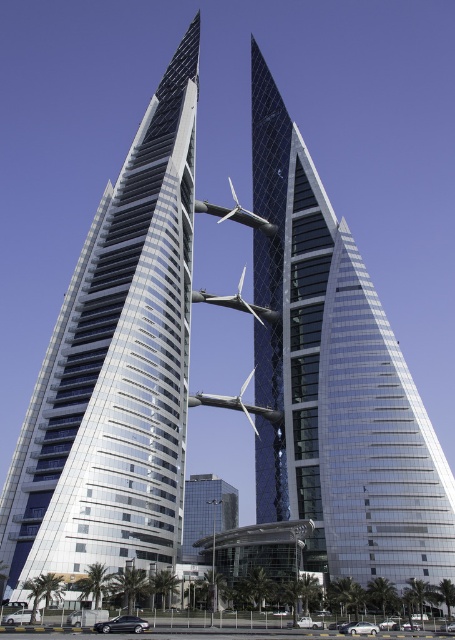
Question: Is shiny glass skyscraper at center closer to camera compared to glassy silver skyscraper at center?

Choices:
 (A) no
 (B) yes

Answer: (B)

Question: Which object appears farthest from the camera in this image?

Choices:
 (A) glassy silver skyscraper at center
 (B) shiny glass skyscraper at center

Answer: (A)

Question: Which object appears farthest from the camera in this image?

Choices:
 (A) shiny glass skyscraper at center
 (B) glassy silver skyscraper at center

Answer: (B)

Question: Is shiny glass skyscraper at center positioned behind glassy silver skyscraper at center?

Choices:
 (A) no
 (B) yes

Answer: (A)

Question: Is shiny glass skyscraper at center to the right of glassy silver skyscraper at center from the viewer's perspective?

Choices:
 (A) yes
 (B) no

Answer: (B)